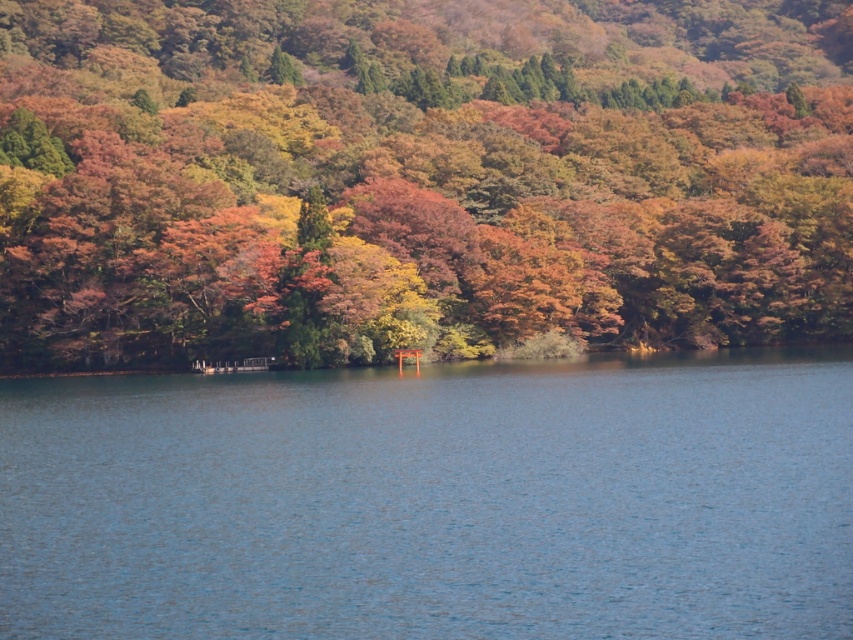
Question: Observing the image, what is the correct spatial positioning of autumn leaves at center in reference to blue water at center?

Choices:
 (A) below
 (B) above

Answer: (B)

Question: Is autumn leaves at center closer to camera compared to blue water at center?

Choices:
 (A) yes
 (B) no

Answer: (B)

Question: Does autumn leaves at center have a larger size compared to blue water at center?

Choices:
 (A) no
 (B) yes

Answer: (B)

Question: Which point is closer to the camera?

Choices:
 (A) [x=119, y=282]
 (B) [x=473, y=596]

Answer: (B)

Question: Which point is closer to the camera?

Choices:
 (A) (659, 330)
 (B) (502, 524)

Answer: (B)